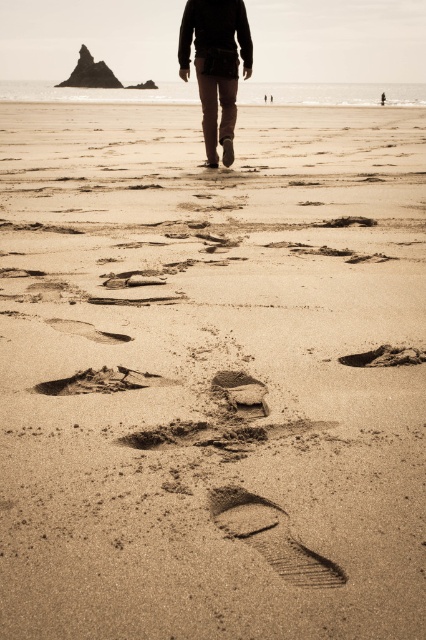
Who is higher up, matte brown pants at center or dark brown sand at center?

matte brown pants at center is above.

Can you confirm if matte brown pants at center is positioned to the right of dark brown sand at center?

Incorrect, matte brown pants at center is not on the right side of dark brown sand at center.

You are a GUI agent. You are given a task and a screenshot of the screen. Output one action in this format:
    pyautogui.click(x=<x>, y=<y>)
    Task: Click on the matte brown pants at center
    Image resolution: width=426 pixels, height=640 pixels.
    Given the screenshot: What is the action you would take?
    pyautogui.click(x=215, y=65)

Locate an element on the screen. This screenshot has width=426, height=640. matte brown pants at center is located at coordinates (215, 65).

Is matte brown pants at center above dark brown textured sand at center?

Correct, matte brown pants at center is located above dark brown textured sand at center.

What do you see at coordinates (215, 65) in the screenshot? I see `matte brown pants at center` at bounding box center [215, 65].

Which is in front, point (201, 76) or point (299, 557)?

Point (299, 557) is more forward.

What are the coordinates of `matte brown pants at center` in the screenshot? It's located at (215, 65).

Who is taller, dark brown textured sand at center or dark brown sand at center?

Standing taller between the two is dark brown textured sand at center.

Is point (311, 561) positioned in front of point (402, 358)?

Yes, it is.

Who is more forward, (241, 524) or (397, 348)?

Positioned in front is point (241, 524).

This screenshot has width=426, height=640. I want to click on dark brown textured sand at center, so click(270, 536).